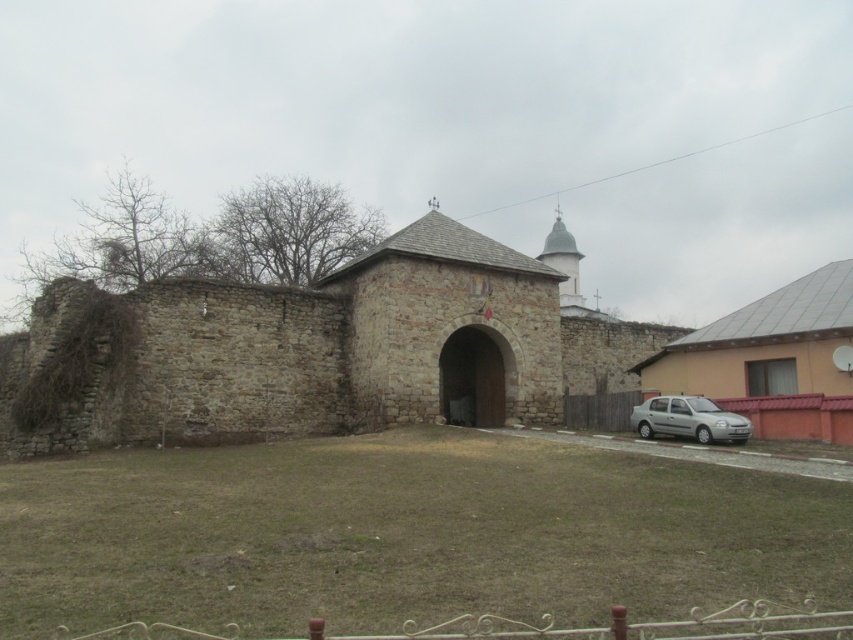
Question: Does green grass at center appear under rustic stone church at center?

Choices:
 (A) no
 (B) yes

Answer: (B)

Question: Among these points, which one is nearest to the camera?

Choices:
 (A) (309, 637)
 (B) (566, 472)

Answer: (A)

Question: Which object appears closest to the camera in this image?

Choices:
 (A) silver metallic car at lower right
 (B) rustic stone church at center
 (C) white wrought iron fence at lower center
 (D) green grass at center

Answer: (C)

Question: Observing the image, what is the correct spatial positioning of green grass at center in reference to wooden fence at lower right?

Choices:
 (A) left
 (B) right

Answer: (A)

Question: Does white wrought iron fence at lower center come behind silver metallic car at lower right?

Choices:
 (A) no
 (B) yes

Answer: (A)

Question: Which is nearer to the silver metallic car at lower right?

Choices:
 (A) white wrought iron fence at lower center
 (B) rustic stone church at center
 (C) green grass at center
 (D) wooden fence at lower right

Answer: (D)